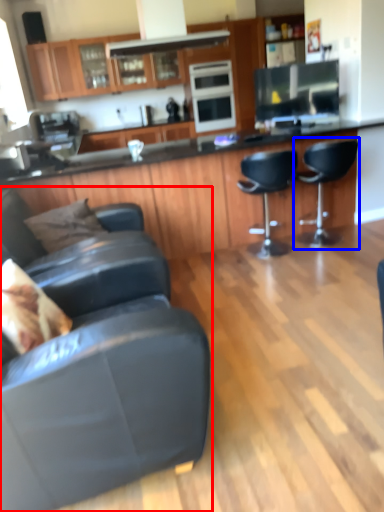
Question: Which point is further to the camera, chair (highlighted by a red box) or chair (highlighted by a blue box)?

Choices:
 (A) chair
 (B) chair

Answer: (B)